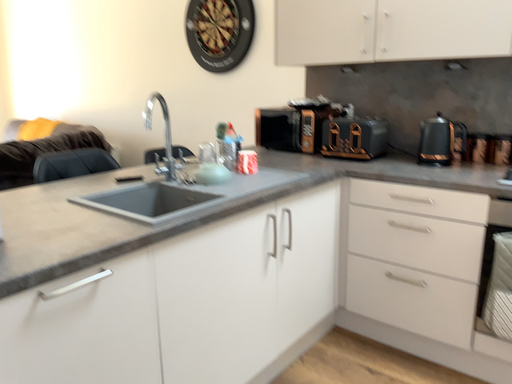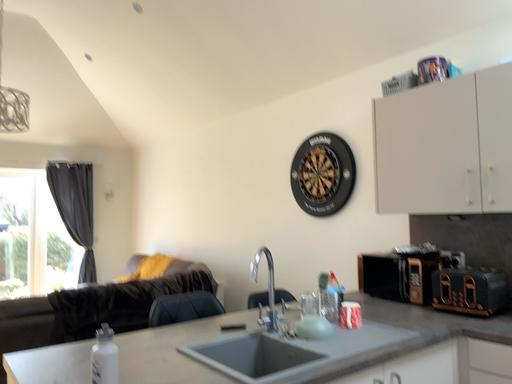
Question: Which way did the camera rotate in the video?

Choices:
 (A) rotated right
 (B) rotated left

Answer: (B)